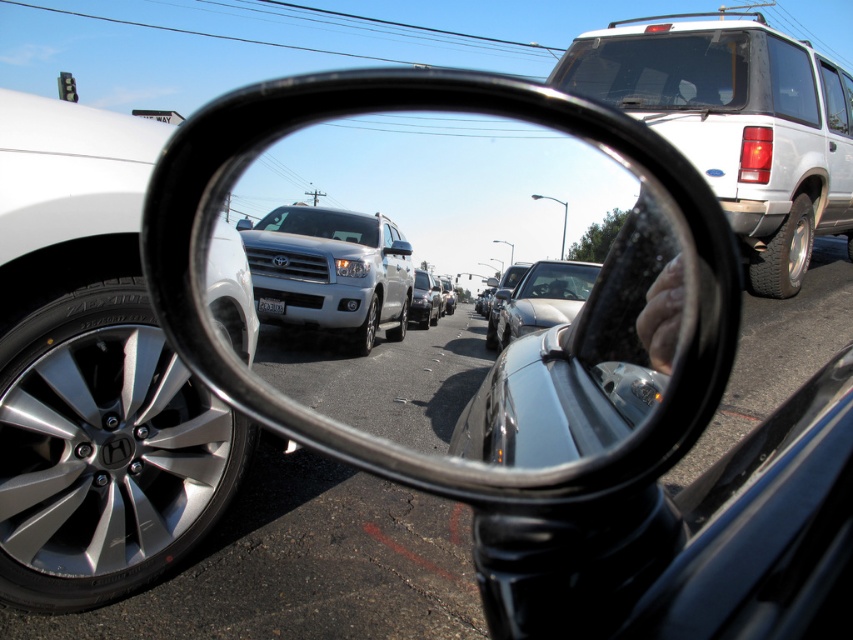
How much distance is there between glossy metallic mirror at center and white matte suv at right?

15.20 meters

Who is more distant from viewer, (606, 209) or (788, 241)?

Point (606, 209)

Image resolution: width=853 pixels, height=640 pixels. What are the coordinates of `glossy metallic mirror at center` in the screenshot? It's located at (459, 282).

Locate an element on the screen. The height and width of the screenshot is (640, 853). glossy metallic mirror at center is located at coordinates (459, 282).

Can you confirm if black rubber mirror at center is bigger than silver metallic sedan at center?

Correct, black rubber mirror at center is larger in size than silver metallic sedan at center.

Does black rubber mirror at center have a smaller size compared to silver metallic sedan at center?

No, black rubber mirror at center is not smaller than silver metallic sedan at center.

Locate an element on the screen. Image resolution: width=853 pixels, height=640 pixels. black rubber mirror at center is located at coordinates (457, 460).

Looking at this image, is black rubber mirror at center above silver metallic tire at left?

No, black rubber mirror at center is not above silver metallic tire at left.

Measure the distance between point [669,202] and camera.

Point [669,202] and camera are 1.18 meters apart from each other.

Locate an element on the screen. The width and height of the screenshot is (853, 640). black rubber mirror at center is located at coordinates (457, 460).